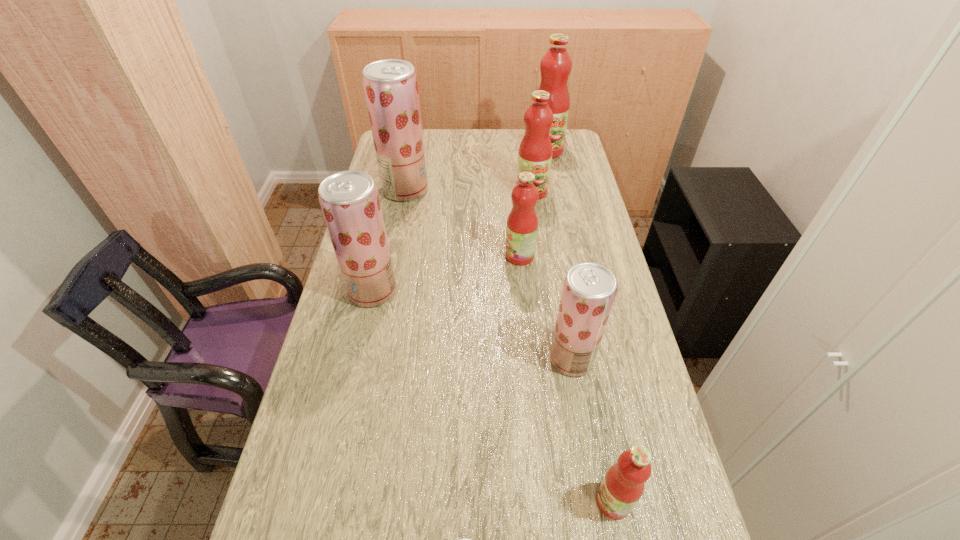
Locate an element on the screen. the farthest strawberry fruit juice is located at coordinates (391, 89).

Locate an element on the screen. The image size is (960, 540). the biggest pink fruit juice is located at coordinates tap(556, 64).

This screenshot has width=960, height=540. Find the location of `the farthest fruit juice`. the farthest fruit juice is located at coordinates (556, 64).

The image size is (960, 540). I want to click on the second farthest pink fruit juice, so [535, 151].

This screenshot has width=960, height=540. What are the coordinates of `the fourth nearest fruit juice` in the screenshot? It's located at (349, 200).

Identify the location of the fourth nearest object. The width and height of the screenshot is (960, 540). (349, 200).

The width and height of the screenshot is (960, 540). What are the coordinates of `the second smallest strawberry fruit juice` in the screenshot? It's located at (589, 290).

The height and width of the screenshot is (540, 960). Identify the location of the sixth farthest object. [x=589, y=290].

This screenshot has height=540, width=960. In order to click on the second nearest pink fruit juice in this screenshot , I will do `click(522, 223)`.

The width and height of the screenshot is (960, 540). I want to click on the second smallest pink fruit juice, so click(x=522, y=223).